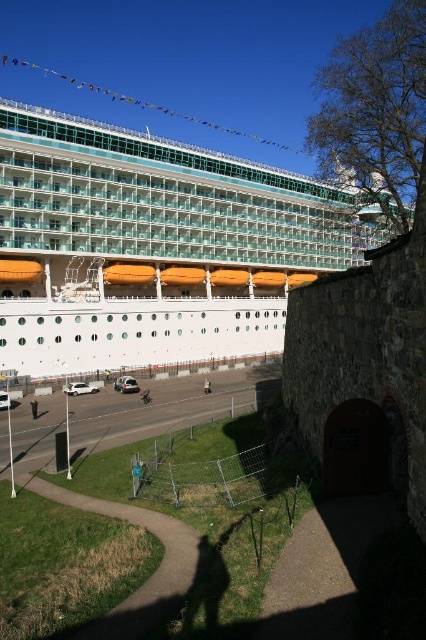
Does white glossy cruise ship at upper left lie behind light brown leather jacket at lower center?

That is True.

Does white glossy cruise ship at upper left have a larger size compared to light brown leather jacket at lower center?

Yes.

Measure the distance between white glossy cruise ship at upper left and camera.

white glossy cruise ship at upper left and camera are 210.11 feet apart from each other.

The image size is (426, 640). I want to click on white glossy cruise ship at upper left, so tap(152, 246).

Does white glossy cruise ship at upper left have a greater width compared to green grass at lower left?

Yes.

Image resolution: width=426 pixels, height=640 pixels. Describe the element at coordinates (152, 246) in the screenshot. I see `white glossy cruise ship at upper left` at that location.

Between point (271, 237) and point (152, 513), which one is positioned behind?

The point (271, 237) is more distant.

Find the location of a particular element. The height and width of the screenshot is (640, 426). white glossy cruise ship at upper left is located at coordinates (152, 246).

Who is positioned more to the right, green grass at lower left or light brown leather jacket at center?

Positioned to the right is light brown leather jacket at center.

Who is positioned more to the left, green grass at lower left or light brown leather jacket at center?

From the viewer's perspective, green grass at lower left appears more on the left side.

What do you see at coordinates (149, 577) in the screenshot?
I see `green grass at lower left` at bounding box center [149, 577].

Where is `green grass at lower left`? The image size is (426, 640). green grass at lower left is located at coordinates (149, 577).